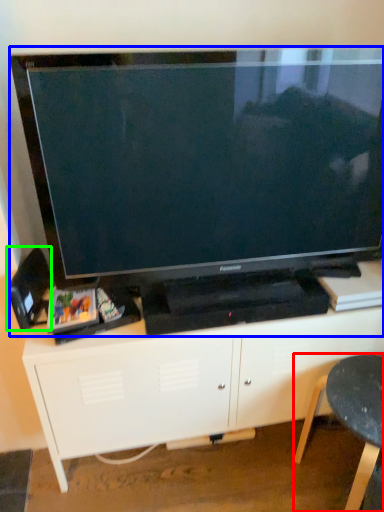
Question: Which object is positioned farthest from furniture (highlighted by a red box)? Select from television (highlighted by a blue box) and speaker (highlighted by a green box).

Choices:
 (A) television
 (B) speaker

Answer: (B)